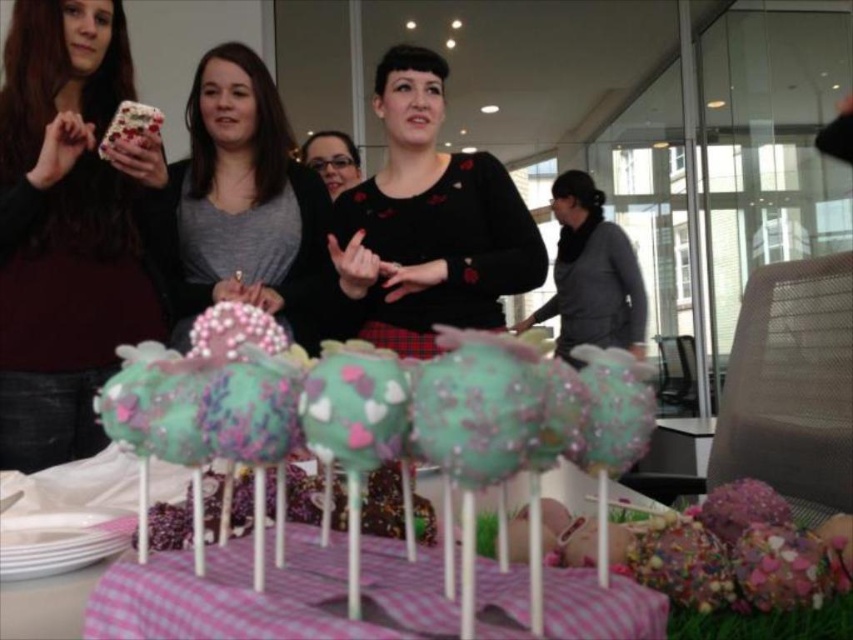
You are at a party and notice two items on the table where the cake pops are placed. The items are the matte gray sweater at center and the matte black glasses at center. Which item is positioned lower on the table?

The matte gray sweater at center is below the matte black glasses at center, so it is positioned lower on the table.

You are organizing a photo shoot and need to place a prop that requires more space between the matte gray sweater at center and the matte black glasses at center. Which object should you place the prop next to?

The matte gray sweater at center has a larger width than the matte black glasses at center, so you should place the prop next to the matte gray sweater at center to accommodate more space.

You are standing at the center of the room and want to place a new cake pop exactly where the matte gray sweater at center is currently located. Is this possible without moving the sweater?

The matte gray sweater at center is located at position point (x=244, y=204). Since the sweater is part of the scene and occupies that space, you cannot place the cake pop there without moving the sweater.